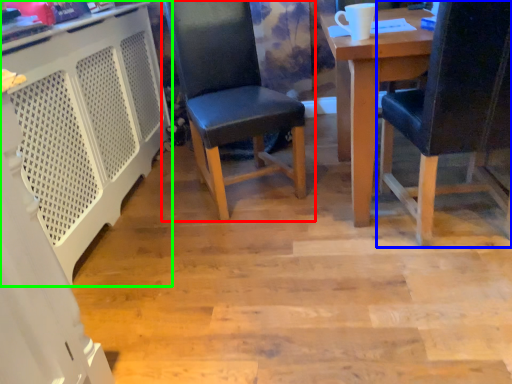
Question: Considering the real-world distances, which object is closest to chair (highlighted by a red box)? chair (highlighted by a blue box) or computer desk (highlighted by a green box).

Choices:
 (A) chair
 (B) computer desk

Answer: (B)